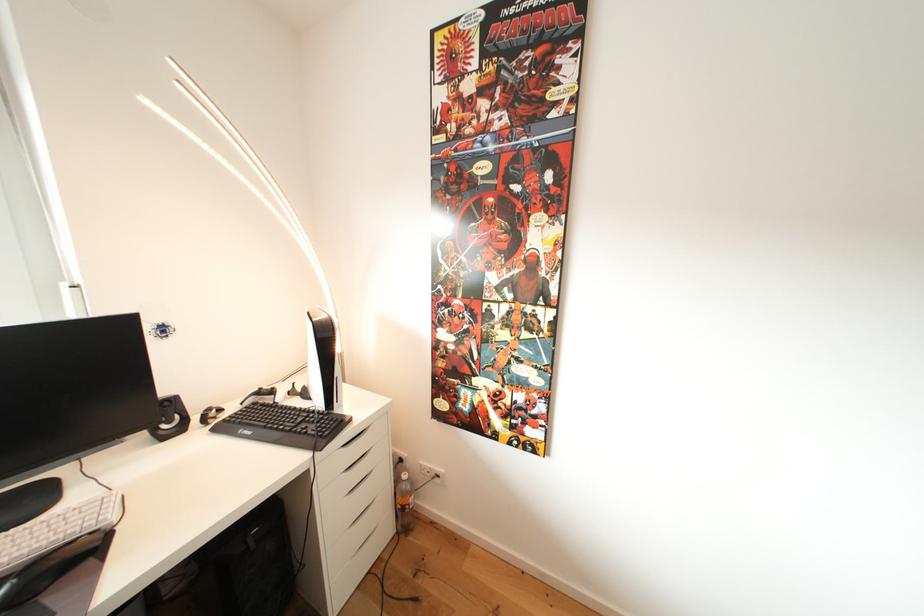
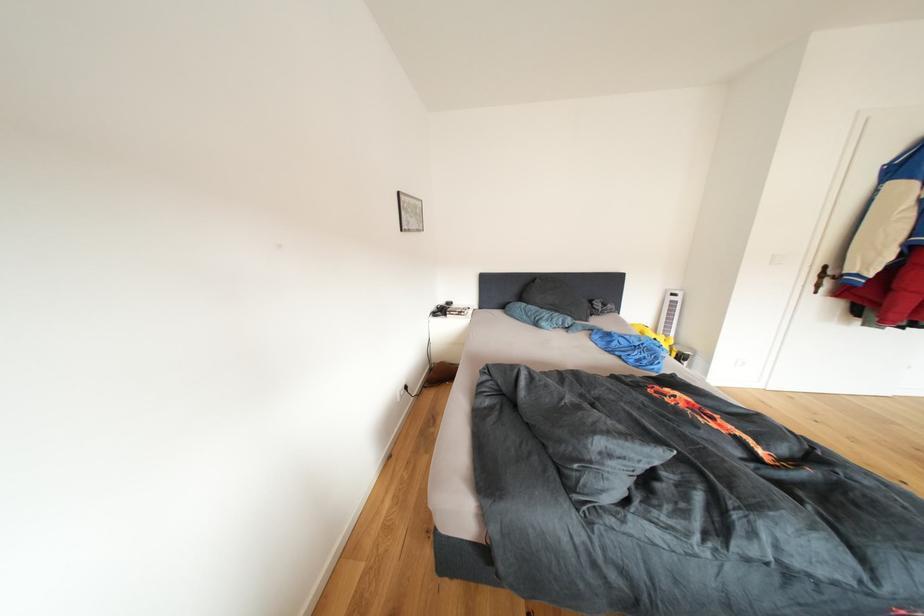
The first image is from the beginning of the video and the second image is from the end. How did the camera likely rotate when shooting the video?

The camera's rotation is toward right-down.